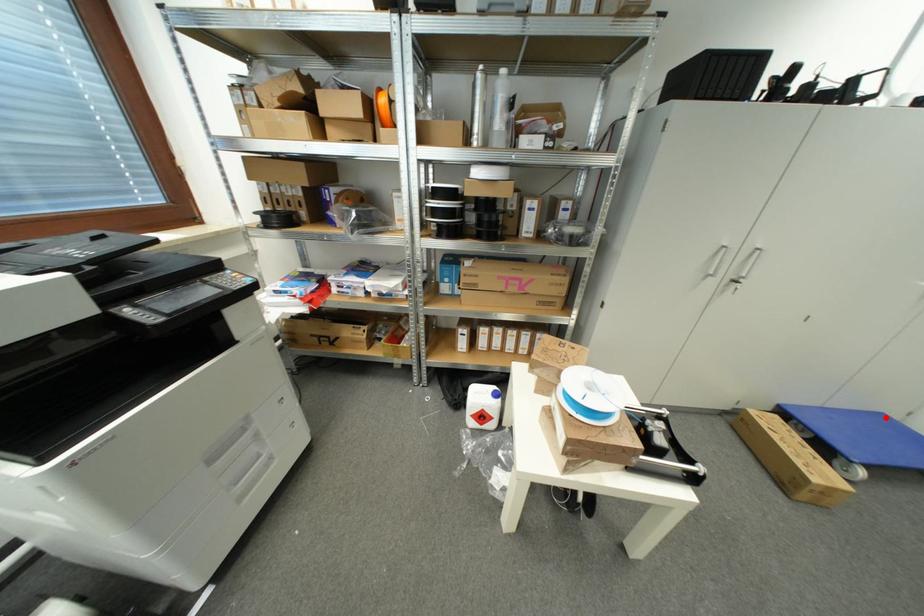
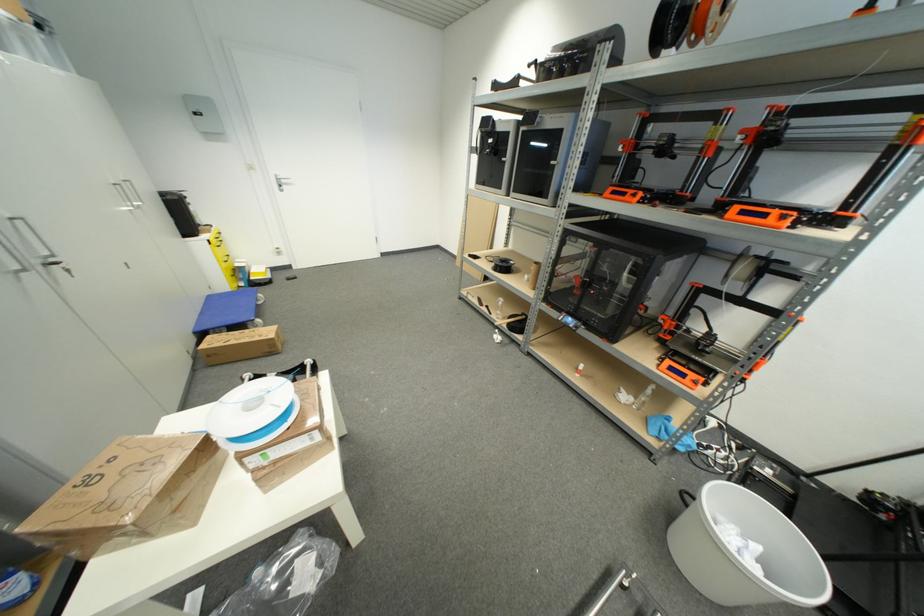
Where in the second image is the point corresponding to the highlighted location from the first image?

(213, 299)